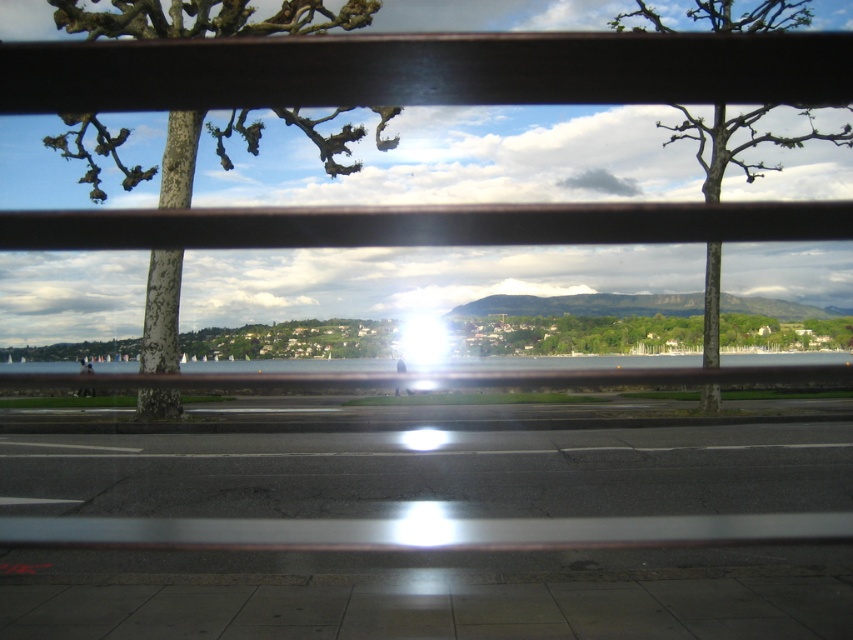
Question: Does bare wood tree at center appear over clear water at center?

Choices:
 (A) yes
 (B) no

Answer: (A)

Question: Is bare wood tree at center bigger than clear water at center?

Choices:
 (A) yes
 (B) no

Answer: (A)

Question: Estimate the real-world distances between objects in this image. Which object is closer to the green rough bark tree at left?

Choices:
 (A) clear water at center
 (B) bare wood tree at center

Answer: (B)

Question: Among these points, which one is nearest to the camera?

Choices:
 (A) (345, 134)
 (B) (817, 364)

Answer: (A)

Question: Which of the following is the farthest from the observer?

Choices:
 (A) (669, 364)
 (B) (730, 147)
 (C) (166, 397)

Answer: (A)

Question: Does bare wood tree at center lie behind clear water at center?

Choices:
 (A) yes
 (B) no

Answer: (B)